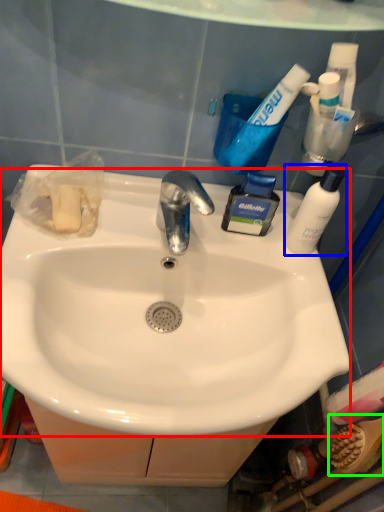
Question: Which is nearer to the sink (highlighted by a red box)? bottle (highlighted by a blue box) or brush (highlighted by a green box).

Choices:
 (A) bottle
 (B) brush

Answer: (A)